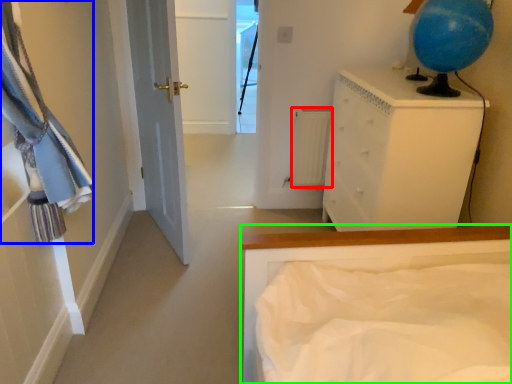
Question: Which object is the farthest from radiator (highlighted by a red box)? Choose among these: laundry (highlighted by a blue box) or bed (highlighted by a green box).

Choices:
 (A) laundry
 (B) bed

Answer: (A)